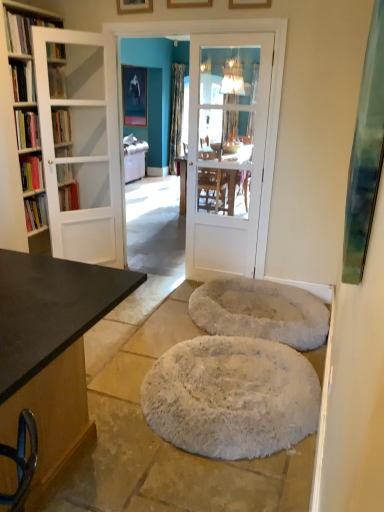
Question: Is metallic silver picture frame at upper center, the fourth picture frame ordered from the bottom, in front of or behind dark brown wood desk at left in the image?

Choices:
 (A) front
 (B) behind

Answer: (B)

Question: Considering the positions of metallic silver picture frame at upper center, which ranks as the first picture frame in left-to-right order, and dark brown wood desk at left in the image, is metallic silver picture frame at upper center, which ranks as the first picture frame in left-to-right order, wider or thinner than dark brown wood desk at left?

Choices:
 (A) thin
 (B) wide

Answer: (A)

Question: Estimate the real-world distances between objects in this image. Which object is closer to the hardcover book at upper left, arranged as the fourth book when ordered from the bottom?

Choices:
 (A) white glossy door at center, the 2th door positioned from the left
 (B) wooden picture frame at upper center, the first picture frame when ordered from front to back
 (C) hardcover book at left, marked as the 2th book in a bottom-to-top arrangement
 (D) white fluffy mat at center, arranged as the 2th mat when viewed from the back
 (E) white glass door at left, which is counted as the 1th door, starting from the left

Answer: (C)

Question: Estimate the real-world distances between objects in this image. Which object is farther from the wooden picture frame at upper center, the 3th picture frame when ordered from front to back?

Choices:
 (A) hardcover book at upper left, which is the first book from top to bottom
 (B) wooden picture frame at upper center, the first picture frame when ordered from front to back
 (C) metallic silver picture frame at upper center, which is counted as the 4th picture frame, starting from the right
 (D) wooden picture frame at upper center, which is the 3th picture frame in top-to-bottom order
 (E) wooden table at center

Answer: (C)